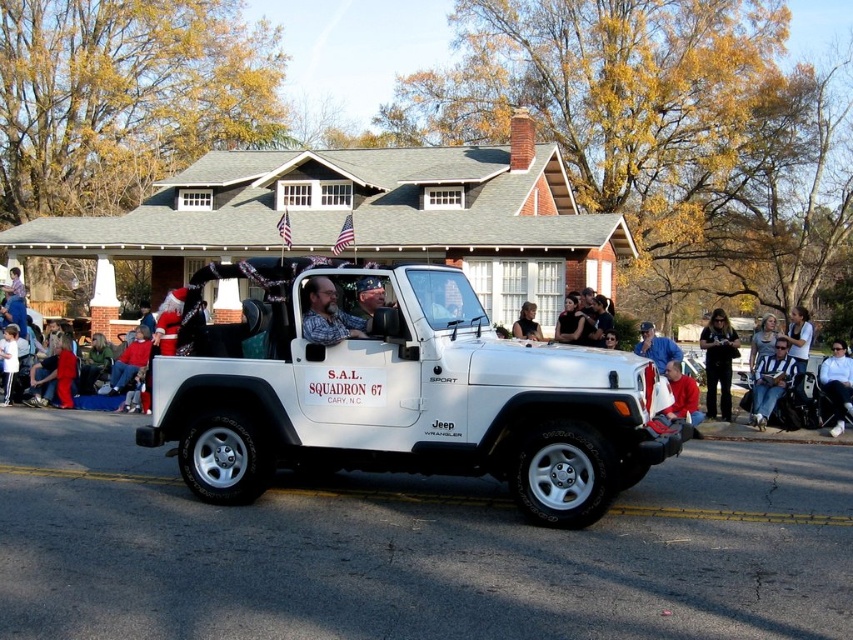
Which of these two, blue denim jacket at center or denim jacket at lower right, stands taller?

denim jacket at lower right is taller.

Measure the distance between blue denim jacket at center and camera.

blue denim jacket at center and camera are 7.79 meters apart from each other.

Identify the location of blue denim jacket at center. (656, 348).

How distant is white matte jeep wrangler at center from black leather jacket at center?

white matte jeep wrangler at center is 6.96 meters from black leather jacket at center.

Which is more to the right, white matte jeep wrangler at center or black leather jacket at center?

Positioned to the right is black leather jacket at center.

Is point (238, 468) closer to camera compared to point (561, 310)?

Yes, it is in front of point (561, 310).

Image resolution: width=853 pixels, height=640 pixels. I want to click on white matte jeep wrangler at center, so click(x=402, y=396).

Describe the element at coordinates (770, 381) in the screenshot. I see `striped shirt at lower right` at that location.

Based on the photo, can you confirm if striped shirt at lower right is positioned above matte black shirt at center?

No.

Does point (775, 355) lie behind point (540, 330)?

No, (775, 355) is in front of (540, 330).

At what (x,y) coordinates should I click in order to perform the action: click on striped shirt at lower right. Please return your answer as a coordinate pair (x, y). The height and width of the screenshot is (640, 853). Looking at the image, I should click on (770, 381).